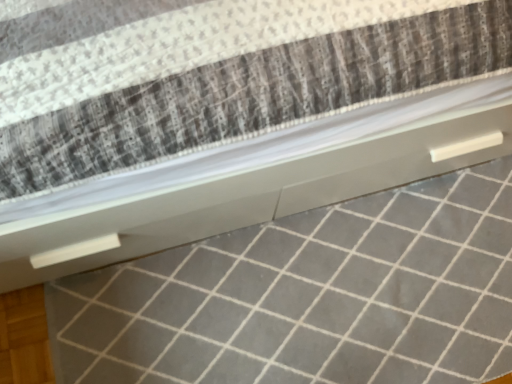
Question: Considering the relative sizes of white glossy tile at center and white textured mattress at center in the image provided, is white glossy tile at center bigger than white textured mattress at center?

Choices:
 (A) yes
 (B) no

Answer: (B)

Question: Is white glossy tile at center next to white textured mattress at center?

Choices:
 (A) yes
 (B) no

Answer: (B)

Question: Is white glossy tile at center located outside white textured mattress at center?

Choices:
 (A) yes
 (B) no

Answer: (A)

Question: Does white glossy tile at center have a lesser width compared to white textured mattress at center?

Choices:
 (A) yes
 (B) no

Answer: (A)

Question: Can you confirm if white glossy tile at center is smaller than white textured mattress at center?

Choices:
 (A) yes
 (B) no

Answer: (A)

Question: Is white glossy tile at center further to camera compared to white textured mattress at center?

Choices:
 (A) yes
 (B) no

Answer: (A)

Question: Is white textured mattress at center touching white glossy tile at center?

Choices:
 (A) yes
 (B) no

Answer: (B)

Question: Is white textured mattress at center closer to the viewer compared to white glossy tile at center?

Choices:
 (A) no
 (B) yes

Answer: (B)

Question: Can you confirm if white textured mattress at center is taller than white glossy tile at center?

Choices:
 (A) yes
 (B) no

Answer: (A)

Question: Considering the relative sizes of white textured mattress at center and white glossy tile at center in the image provided, is white textured mattress at center smaller than white glossy tile at center?

Choices:
 (A) no
 (B) yes

Answer: (A)

Question: From the image's perspective, is white textured mattress at center located beneath white glossy tile at center?

Choices:
 (A) no
 (B) yes

Answer: (A)

Question: Does white textured mattress at center have a larger size compared to white glossy tile at center?

Choices:
 (A) no
 (B) yes

Answer: (B)

Question: From their relative heights in the image, would you say white glossy tile at center is taller or shorter than white textured mattress at center?

Choices:
 (A) tall
 (B) short

Answer: (B)